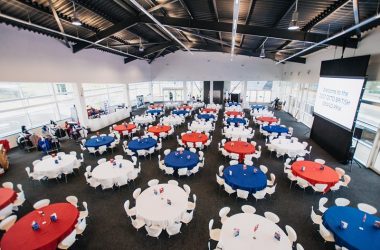
The height and width of the screenshot is (250, 380). I want to click on floor, so click(121, 234).